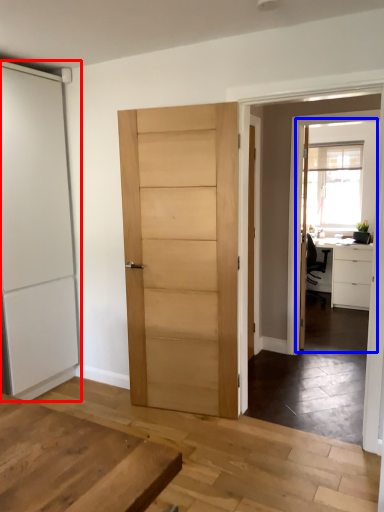
Question: Among these objects, which one is farthest to the camera, door (highlighted by a red box) or screen door (highlighted by a blue box)?

Choices:
 (A) door
 (B) screen door

Answer: (B)